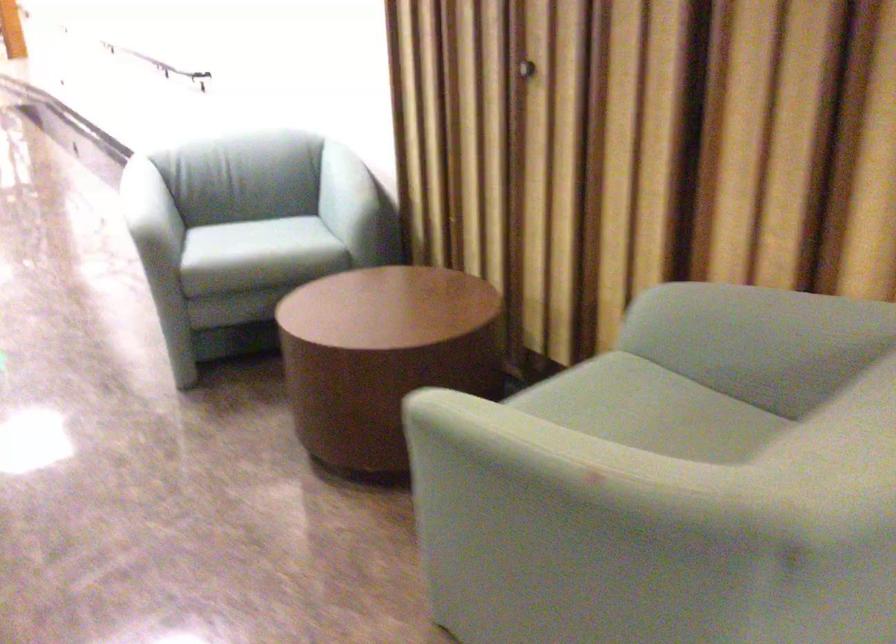
This screenshot has height=644, width=896. In order to click on round door handle in this screenshot , I will do `click(524, 70)`.